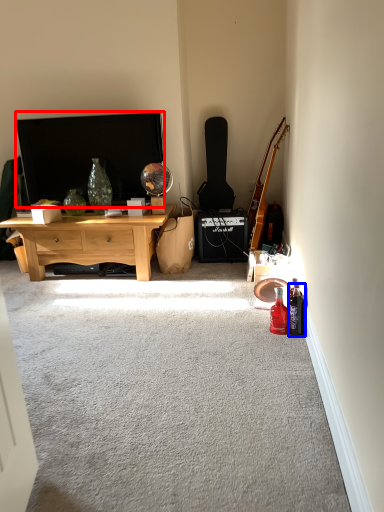
Question: Which point is closer to the camera, television (highlighted by a red box) or bottle (highlighted by a blue box)?

Choices:
 (A) television
 (B) bottle

Answer: (B)